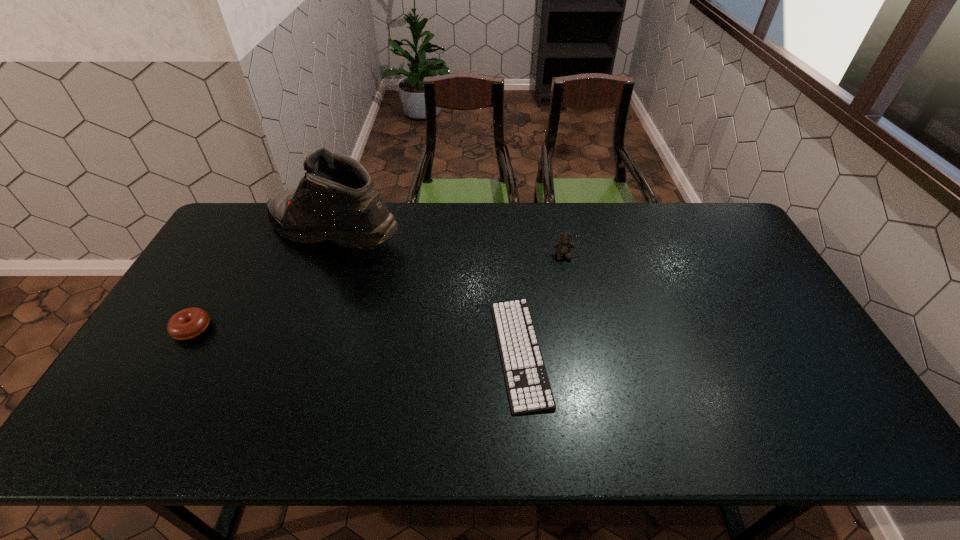
This screenshot has height=540, width=960. What are the coordinates of `free space located on the front of the leftmost object` in the screenshot? It's located at [158, 386].

Find the location of `vacant space situated on the back of the computer keyboard`. vacant space situated on the back of the computer keyboard is located at coordinates (511, 231).

The height and width of the screenshot is (540, 960). What are the coordinates of `object that is at the far edge` in the screenshot? It's located at (336, 200).

What are the coordinates of `object present at the near edge` in the screenshot? It's located at (529, 391).

At what (x,y) coordinates should I click in order to perform the action: click on ski boot situated at the left edge. Please return your answer as a coordinate pair (x, y). The image size is (960, 540). Looking at the image, I should click on (336, 200).

At what (x,y) coordinates should I click in order to perform the action: click on doughnut located in the left edge section of the desktop. Please return your answer as a coordinate pair (x, y). This screenshot has height=540, width=960. Looking at the image, I should click on (188, 323).

The height and width of the screenshot is (540, 960). Find the location of `object that is at the far left corner`. object that is at the far left corner is located at coordinates (336, 200).

Locate an element on the screen. This screenshot has width=960, height=540. vacant space at the far edge of the desktop is located at coordinates (562, 223).

This screenshot has height=540, width=960. What are the coordinates of `vacant space at the near edge` in the screenshot? It's located at (235, 444).

Image resolution: width=960 pixels, height=540 pixels. In order to click on free spot at the left edge of the desktop in this screenshot , I will do pos(188,361).